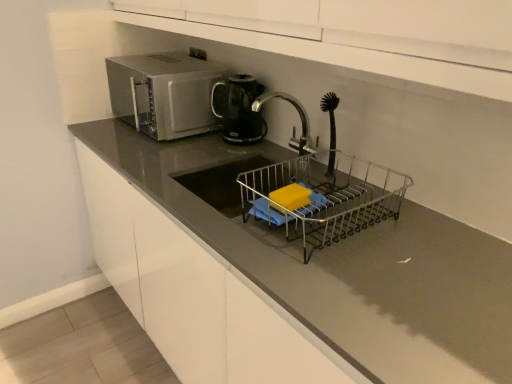
Question: Does satin silver microwave at upper left have a smaller size compared to black plastic kettle at upper center?

Choices:
 (A) yes
 (B) no

Answer: (B)

Question: Is satin silver microwave at upper left bigger than black plastic kettle at upper center?

Choices:
 (A) yes
 (B) no

Answer: (A)

Question: Can you confirm if satin silver microwave at upper left is positioned to the right of black plastic kettle at upper center?

Choices:
 (A) yes
 (B) no

Answer: (B)

Question: From the image's perspective, does satin silver microwave at upper left appear higher than black plastic kettle at upper center?

Choices:
 (A) yes
 (B) no

Answer: (A)

Question: From a real-world perspective, is satin silver microwave at upper left located higher than black plastic kettle at upper center?

Choices:
 (A) no
 (B) yes

Answer: (B)

Question: Can you confirm if satin silver microwave at upper left is wider than black plastic kettle at upper center?

Choices:
 (A) no
 (B) yes

Answer: (B)

Question: Is silver metallic tap at center not close to matte gray countertop at center?

Choices:
 (A) yes
 (B) no

Answer: (B)

Question: From a real-world perspective, is silver metallic tap at center under matte gray countertop at center?

Choices:
 (A) no
 (B) yes

Answer: (A)

Question: Is matte gray countertop at center located within silver metallic tap at center?

Choices:
 (A) yes
 (B) no

Answer: (B)

Question: Considering the relative positions of silver metallic tap at center and matte gray countertop at center in the image provided, is silver metallic tap at center behind matte gray countertop at center?

Choices:
 (A) yes
 (B) no

Answer: (A)

Question: Is silver metallic tap at center to the left of matte gray countertop at center from the viewer's perspective?

Choices:
 (A) yes
 (B) no

Answer: (B)

Question: Is silver metallic tap at center not within matte gray countertop at center?

Choices:
 (A) no
 (B) yes

Answer: (B)

Question: Is matte gray countertop at center positioned in front of metallic wire dish rack at center?

Choices:
 (A) no
 (B) yes

Answer: (B)